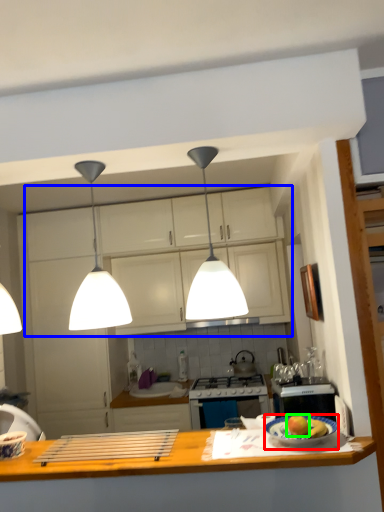
Question: Considering the real-world distances, which object is farthest from plate (highlighted by a red box)? cabinetry (highlighted by a blue box) or apple (highlighted by a green box)?

Choices:
 (A) cabinetry
 (B) apple

Answer: (A)